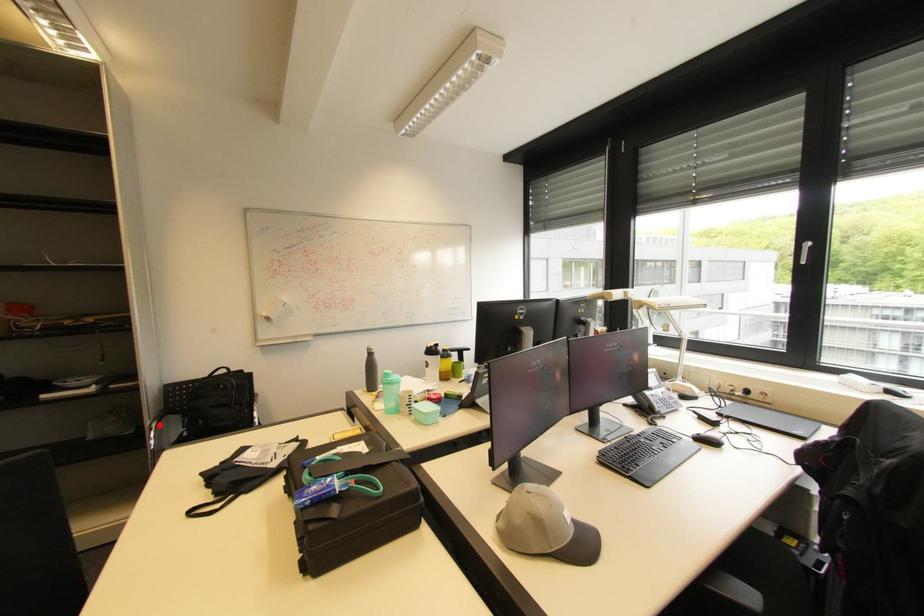
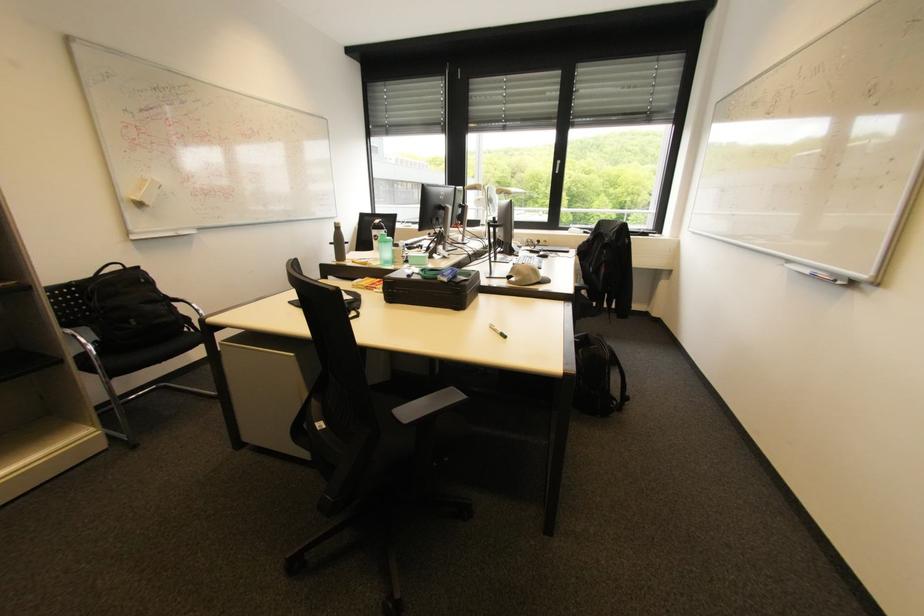
Question: I am providing you with two images of the same scene from different viewpoints. A red point is marked on the first image. At the location where the point appears in image 1, is it still visible in image 2?

Choices:
 (A) Yes
 (B) No

Answer: (A)